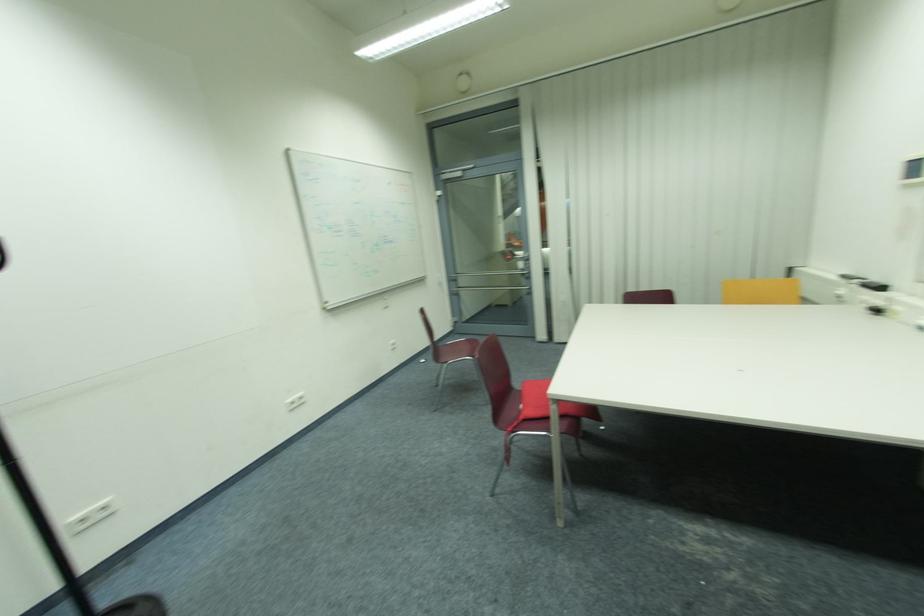
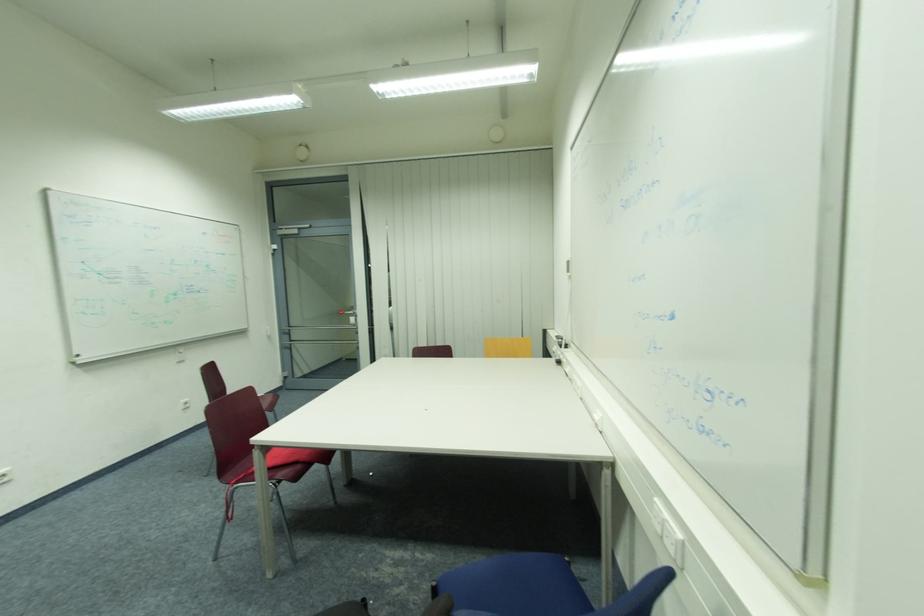
Question: The camera is either moving clockwise (left) or counter-clockwise (right) around the object. The first image is from the beginning of the video and the second image is from the end. Is the camera moving left or right when shooting the video?

Choices:
 (A) Left
 (B) Right

Answer: (A)